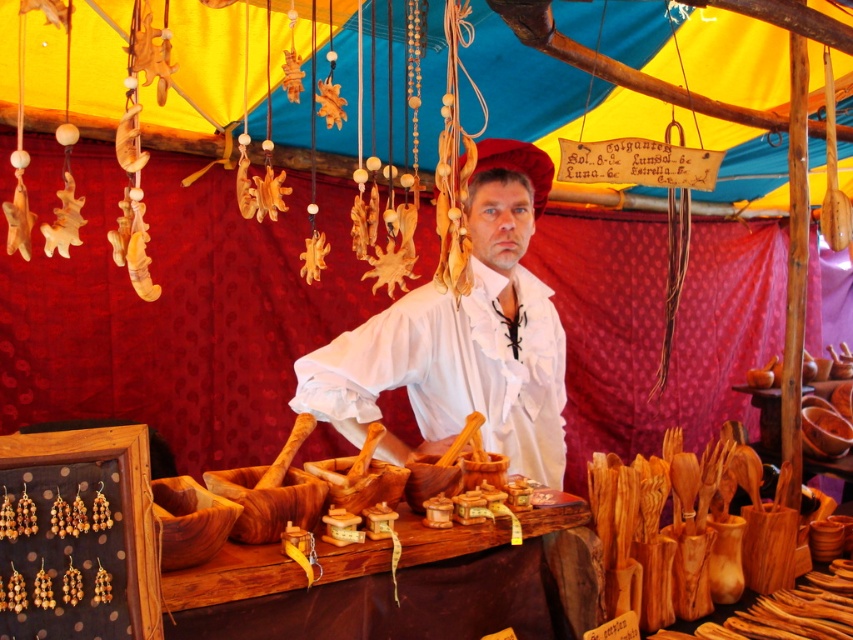
Who is more forward, (544,310) or (397,627)?

Point (397,627)

Which is in front, point (334, 349) or point (457, 580)?

Point (457, 580) is more forward.

Locate an element on the screen. The height and width of the screenshot is (640, 853). white matte shirt at center is located at coordinates (462, 339).